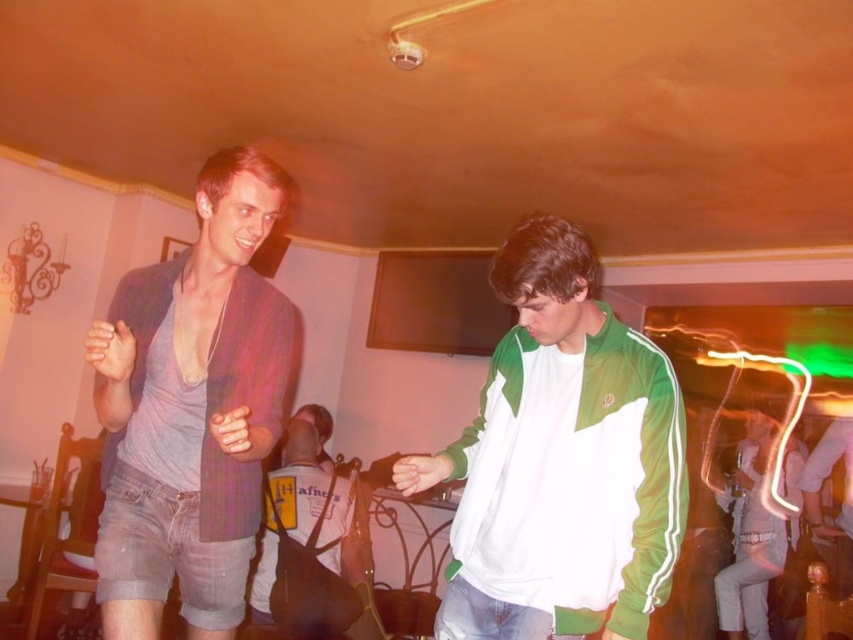
Question: Can you confirm if matte purple shirt at left is bigger than white satin dress at lower right?

Choices:
 (A) yes
 (B) no

Answer: (B)

Question: Which of these objects is positioned farthest from the yellow fabric backpack at center?

Choices:
 (A) white satin dress at lower right
 (B) white/green track jacket at center
 (C) matte purple shirt at left

Answer: (A)

Question: Among these objects, which one is farthest from the camera?

Choices:
 (A) yellow fabric backpack at center
 (B) white/green track jacket at center

Answer: (A)

Question: Considering the relative positions of white/green track jacket at center and matte purple shirt at left in the image provided, where is white/green track jacket at center located with respect to matte purple shirt at left?

Choices:
 (A) right
 (B) left

Answer: (A)

Question: Can you confirm if white/green track jacket at center is positioned to the left of matte purple shirt at left?

Choices:
 (A) yes
 (B) no

Answer: (B)

Question: Which object is positioned closest to the white satin dress at lower right?

Choices:
 (A) white/green track jacket at center
 (B) matte purple shirt at left

Answer: (A)